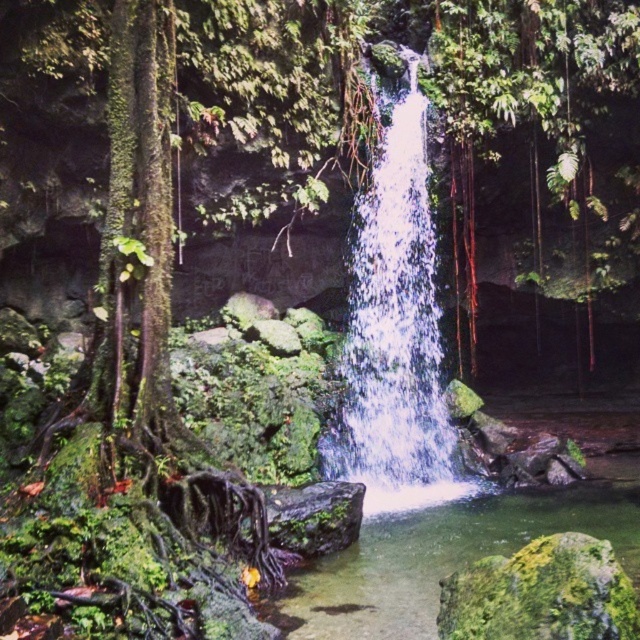
Is the position of white frothy water at center more distant than that of green mossy rock at center?

Yes, it is.

Is point (397, 442) less distant than point (529, 577)?

No.

Which is in front, point (406, 460) or point (524, 596)?

Point (524, 596) is in front.

This screenshot has height=640, width=640. I want to click on white frothy water at center, so click(x=394, y=330).

Locate an element on the screen. This screenshot has width=640, height=640. clear water at center is located at coordinates (440, 557).

Can you confirm if clear water at center is smaller than green mossy rock at center?

Yes, clear water at center is smaller than green mossy rock at center.

What are the coordinates of `clear water at center` in the screenshot? It's located at (440, 557).

Based on the photo, which is more to the right, white frothy water at center or clear water at center?

clear water at center

Is point (381, 355) positioned before point (412, 516)?

No.

Does point (404, 113) lie in front of point (513, 536)?

No, (404, 113) is behind (513, 536).

Locate an element on the screen. white frothy water at center is located at coordinates (394, 330).